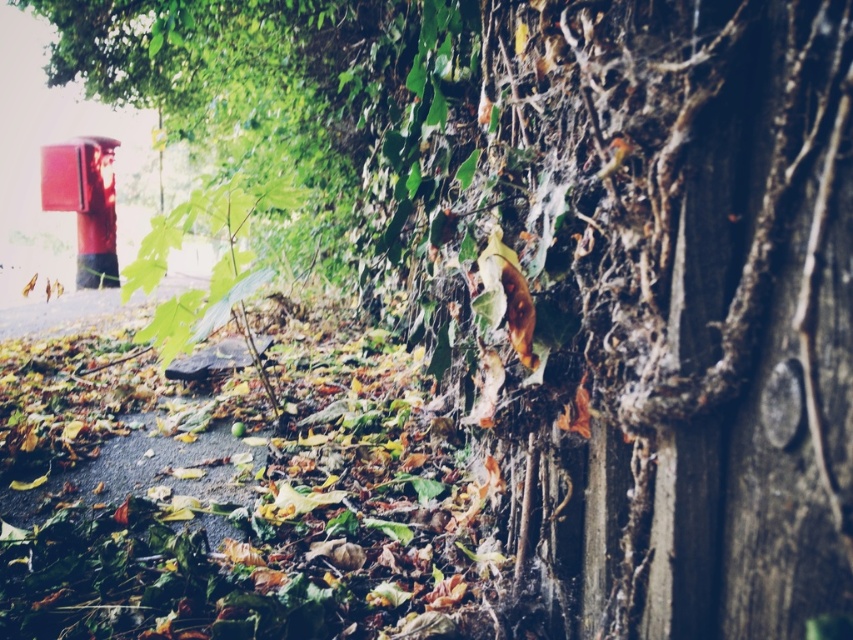
You are a painter who wants to paint the dark brown wood at center and the metallic red fire hydrant at upper left. Which object should you focus on first if you want to paint the taller object first?

The metallic red fire hydrant at upper left is taller than the dark brown wood at center, so you should focus on painting the metallic red fire hydrant at upper left first.

You are a painter standing at the center of the scene. You want to paint both the dark brown wood at center and the metallic red fire hydrant at upper left. If your paintbrush can cover an area within 20 feet, can you reach both objects without moving?

The dark brown wood at center and metallic red fire hydrant at upper left are 22.82 feet apart, so the distance between them exceeds the 20 feet coverage of your paintbrush. You will need to move to paint both.